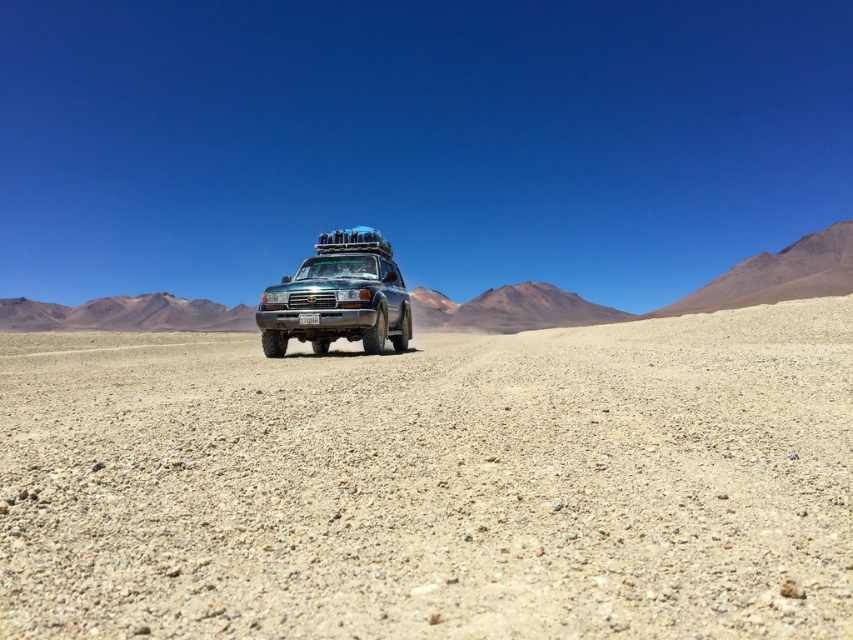
Which is more to the right, light brown gravel at center or green matte jeep at center?

Positioned to the right is light brown gravel at center.

Can you confirm if light brown gravel at center is thinner than green matte jeep at center?

In fact, light brown gravel at center might be wider than green matte jeep at center.

Is point (821, 538) less distant than point (375, 346)?

Yes, point (821, 538) is in front of point (375, 346).

Where is `light brown gravel at center`? The width and height of the screenshot is (853, 640). light brown gravel at center is located at coordinates (433, 483).